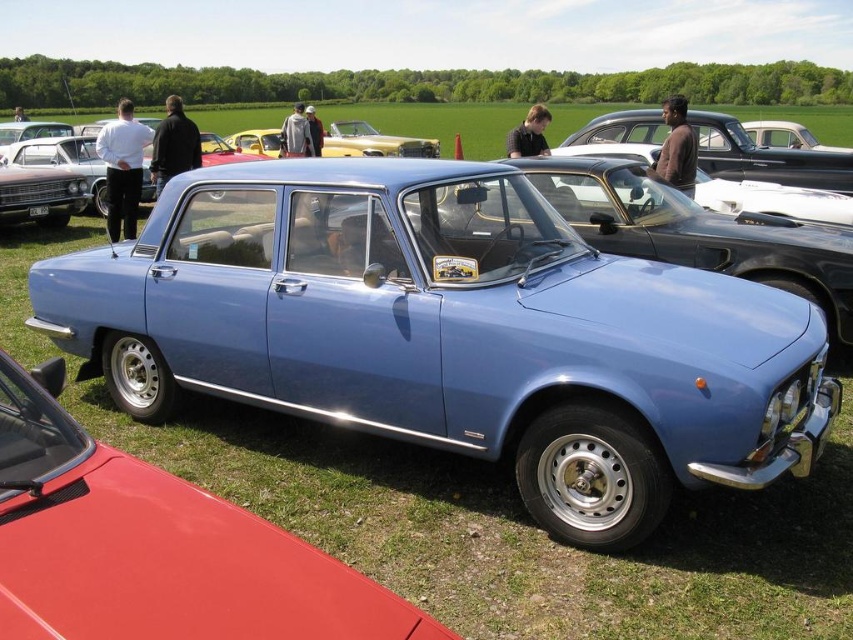
You are a photographer at a classic car show. You want to take a photo of the matte blue car at center and the matte blue sedan at center. According to the scene description, which one is positioned lower in the image?

The matte blue car at center is positioned lower than the matte blue sedan at center in the image.

You are a photographer at the car show and want to capture both the matte blue sedan at center and the gold metallic vintage car at center in a single shot. Based on their positions, which car should you focus on first to ensure both are in the frame?

The matte blue sedan at center is in front of the gold metallic vintage car at center, so you should focus on the matte blue sedan at center first to ensure both are in the frame.